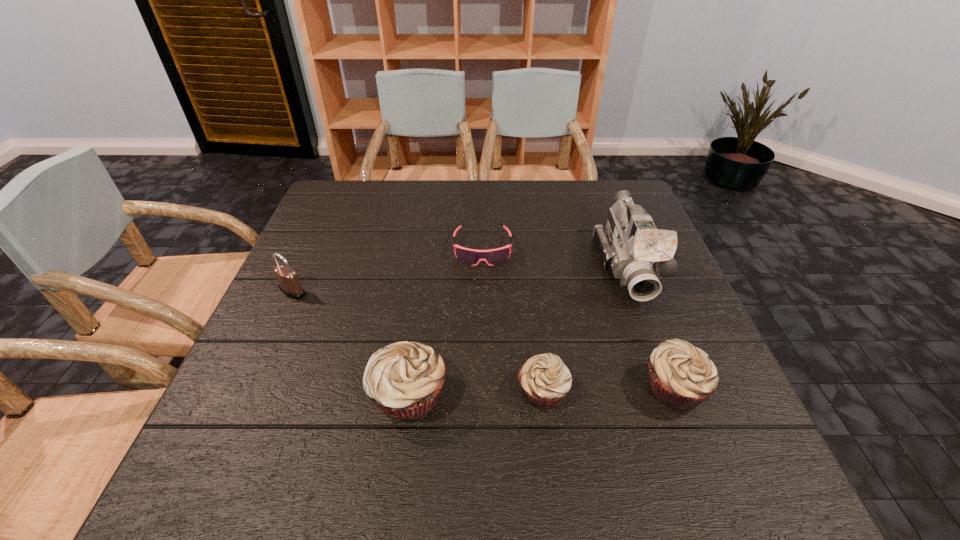
Image resolution: width=960 pixels, height=540 pixels. I want to click on free space at the left edge, so click(331, 226).

At what (x,y) coordinates should I click in order to perform the action: click on blank area at the near left corner. Please return your answer as a coordinate pair (x, y). This screenshot has width=960, height=540. Looking at the image, I should click on (264, 427).

You are a GUI agent. You are given a task and a screenshot of the screen. Output one action in this format:
    pyautogui.click(x=<x>, y=<y>)
    Task: Click on the vacant region at the far right corner of the desktop
    The image size is (960, 540).
    Given the screenshot: What is the action you would take?
    pyautogui.click(x=604, y=212)

Locate an element on the screen. Image resolution: width=960 pixels, height=540 pixels. blank region between the fourth tallest object and the second muffin from left to right is located at coordinates (609, 389).

Locate an element on the screen. This screenshot has height=540, width=960. vacant area between the camcorder and the shortest object is located at coordinates coord(555,258).

Image resolution: width=960 pixels, height=540 pixels. What are the coordinates of `vacant point located between the padlock and the shortest muffin` in the screenshot? It's located at (418, 342).

Where is `free spot between the padlock and the camcorder`? Image resolution: width=960 pixels, height=540 pixels. free spot between the padlock and the camcorder is located at coordinates click(x=460, y=279).

At what (x,y) coordinates should I click in order to perform the action: click on free space that is in between the shortest muffin and the padlock. Please return your answer as a coordinate pair (x, y). Looking at the image, I should click on (418, 342).

Where is `free point between the tallest object and the padlock`? This screenshot has height=540, width=960. free point between the tallest object and the padlock is located at coordinates (460, 279).

You are a GUI agent. You are given a task and a screenshot of the screen. Output one action in this format:
    pyautogui.click(x=<x>, y=<y>)
    Task: Click on the vacant space in between the tallest muffin and the leftmost object
    The height and width of the screenshot is (540, 960).
    Given the screenshot: What is the action you would take?
    tap(350, 343)